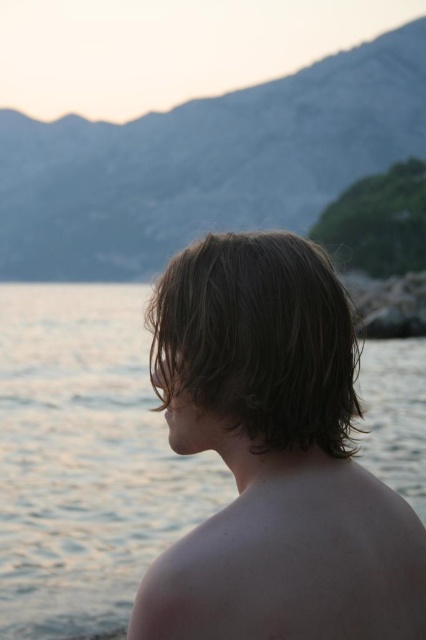
Question: Which of the following is the farthest from the observer?

Choices:
 (A) (247, 396)
 (B) (322, 396)

Answer: (A)

Question: From the image, what is the correct spatial relationship of brown matte hair at center in relation to pale skin at back?

Choices:
 (A) above
 (B) below

Answer: (A)

Question: Which object is farther from the camera taking this photo?

Choices:
 (A) brown matte hair at center
 (B) pale skin at back

Answer: (A)

Question: Estimate the real-world distances between objects in this image. Which object is closer to the dark brown wavy hair at center?

Choices:
 (A) brown matte hair at center
 (B) pale skin at back

Answer: (A)

Question: Can you confirm if pale skin at back is wider than dark brown wavy hair at center?

Choices:
 (A) no
 (B) yes

Answer: (B)

Question: Does pale skin at back have a smaller size compared to dark brown wavy hair at center?

Choices:
 (A) no
 (B) yes

Answer: (A)